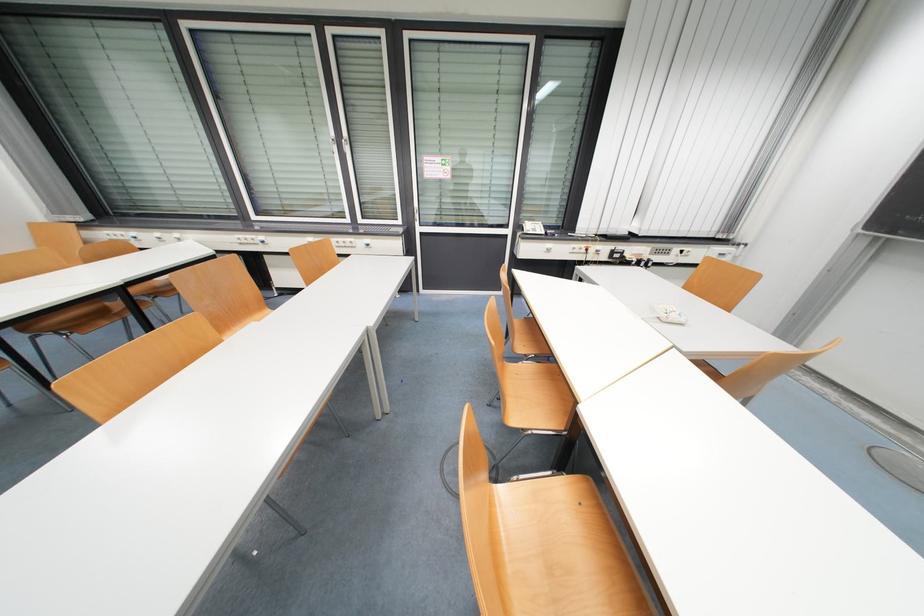
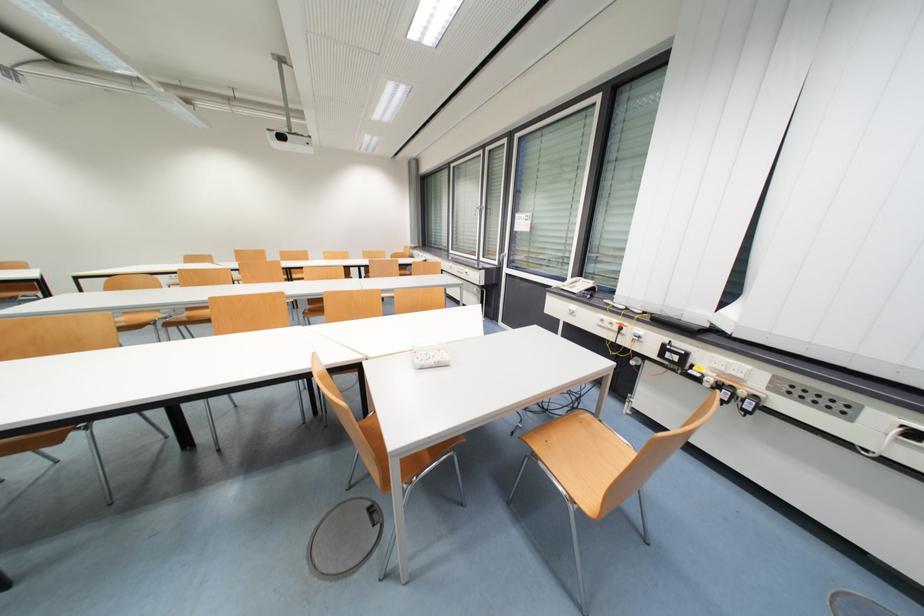
In the second image, find the point that corresponds to (x=554, y=246) in the first image.

(578, 309)